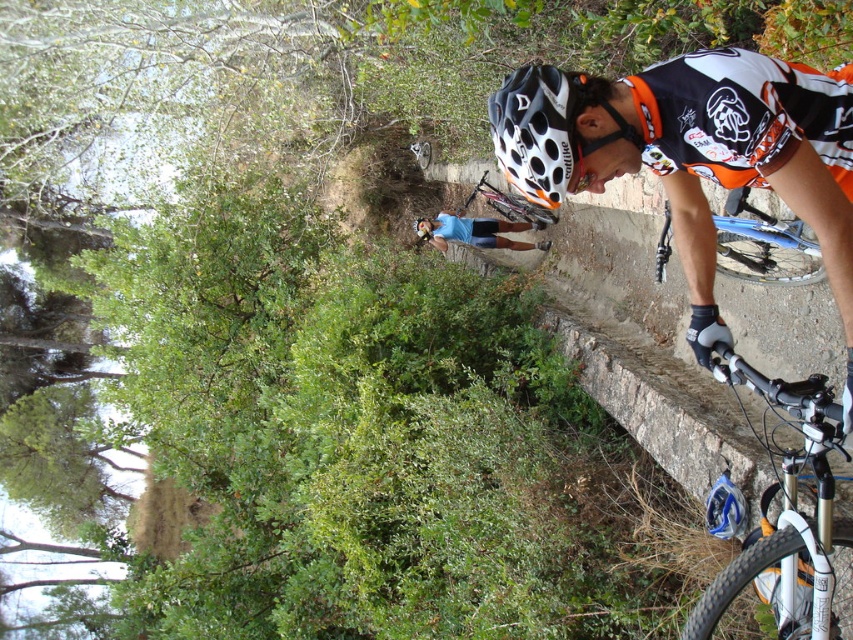
Question: Can you confirm if blue metallic bicycle at right is bigger than blue denim shorts at center?

Choices:
 (A) no
 (B) yes

Answer: (A)

Question: Can you confirm if white matte bicycle at lower right is bigger than white dotted plastic helmet at center?

Choices:
 (A) yes
 (B) no

Answer: (A)

Question: Can you confirm if white matte bicycle at lower right is wider than blue metallic bicycle at right?

Choices:
 (A) no
 (B) yes

Answer: (B)

Question: Among these objects, which one is farthest from the camera?

Choices:
 (A) white dotted plastic helmet at center
 (B) white matte bicycle at lower right
 (C) blue metallic bicycle at right
 (D) blue denim shorts at center

Answer: (D)

Question: Which object is farther from the camera taking this photo?

Choices:
 (A) matte black bicycle at center
 (B) blue denim shorts at center

Answer: (B)

Question: Which point appears closest to the camera in this image?

Choices:
 (A) (830, 540)
 (B) (500, 211)

Answer: (A)